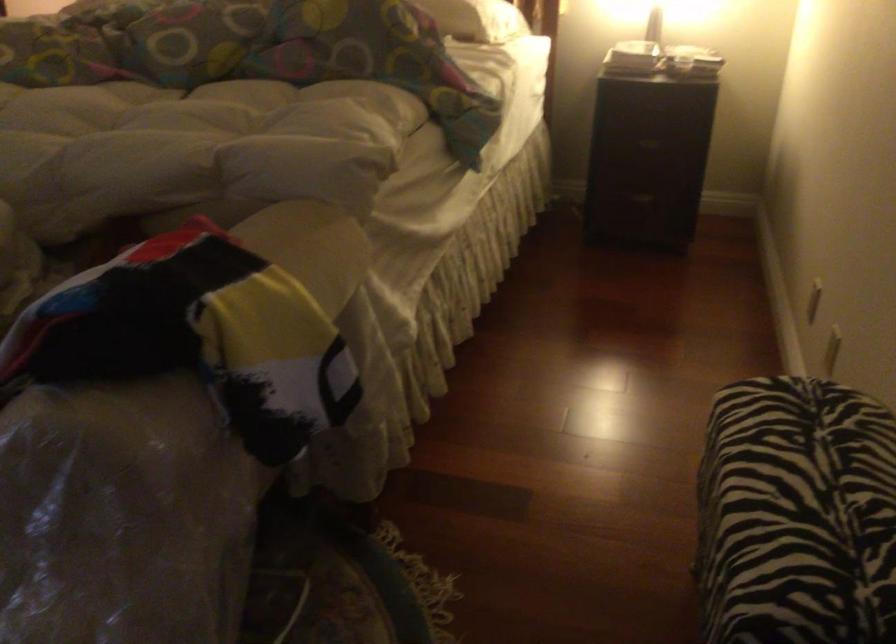
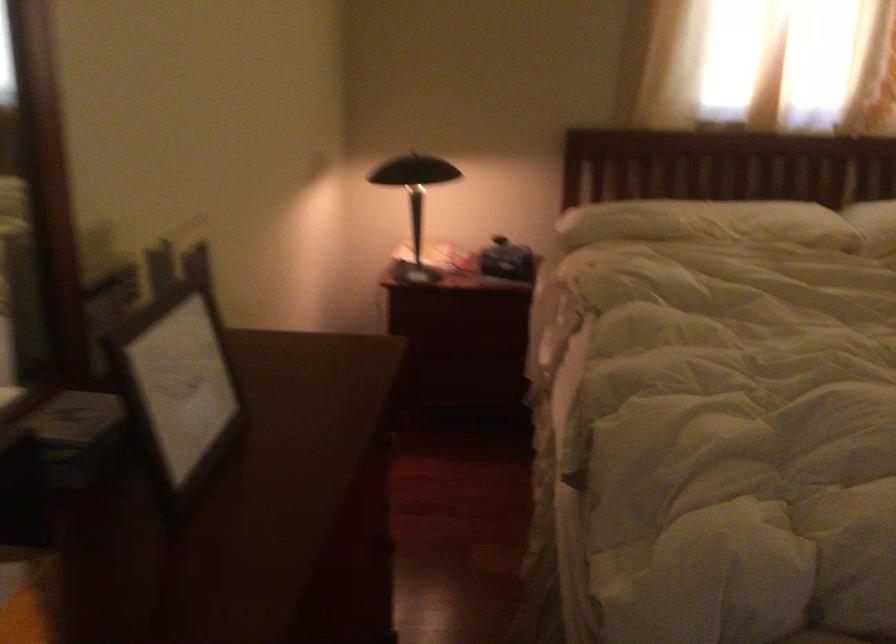
In a continuous first-person perspective shot, in which direction is the camera moving?

The movement direction of the cameraman is left, forward.